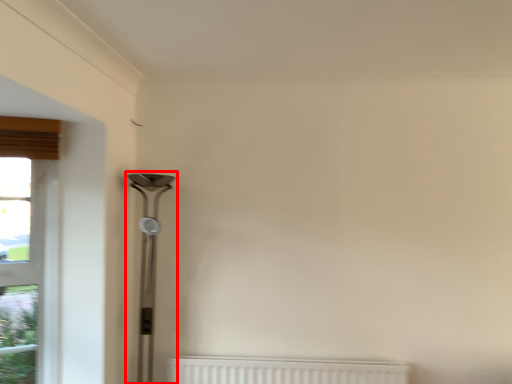
Question: Considering the relative positions of table lamp (annotated by the red box) and window in the image provided, where is table lamp (annotated by the red box) located with respect to the staircase?

Choices:
 (A) right
 (B) left

Answer: (A)